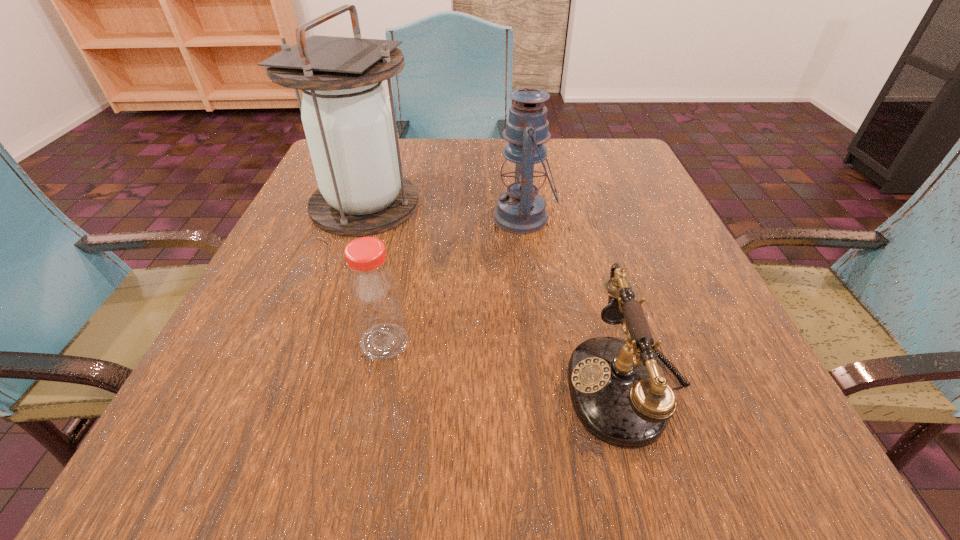
Identify the location of the taller lantern. This screenshot has width=960, height=540. (350, 125).

At what (x,y) coordinates should I click in order to perform the action: click on the left lantern. Please return your answer as a coordinate pair (x, y). Looking at the image, I should click on (350, 125).

Where is `the right lantern`? the right lantern is located at coordinates (521, 210).

Where is `the second tallest object`? This screenshot has height=540, width=960. the second tallest object is located at coordinates (521, 210).

You are a GUI agent. You are given a task and a screenshot of the screen. Output one action in this format:
    pyautogui.click(x=<x>, y=<y>)
    Task: Click on the bottle
    This screenshot has width=960, height=540.
    Given the screenshot: What is the action you would take?
    pyautogui.click(x=373, y=292)

I want to click on telephone, so click(x=618, y=394).

In order to click on blank area located on the front of the taller lantern in this screenshot , I will do `click(335, 289)`.

Identify the location of free space located 0.340m on the front-facing side of the shorter lantern. (322, 218).

Locate an element on the screen. This screenshot has width=960, height=540. free space located 0.400m on the front-facing side of the shorter lantern is located at coordinates (291, 218).

The width and height of the screenshot is (960, 540). In order to click on free point located on the front-facing side of the shorter lantern in this screenshot , I will do `click(397, 218)`.